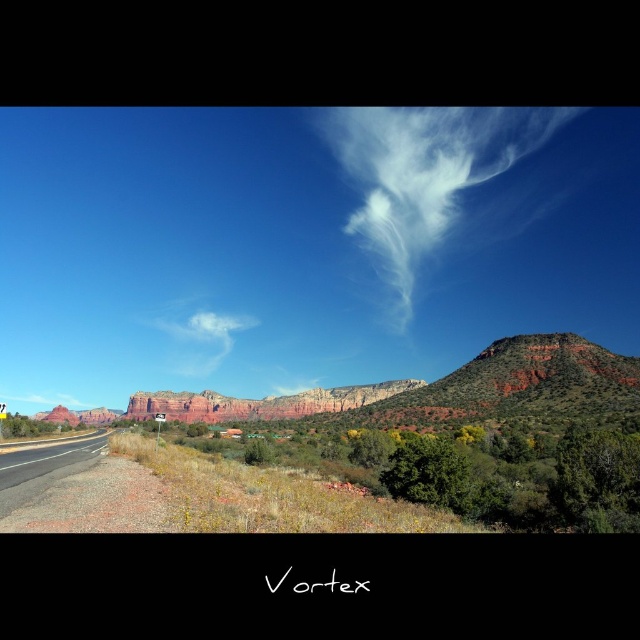
Question: Does white cotton cloud at upper center have a greater width compared to reddish-brown rocky mountain at center-right?

Choices:
 (A) yes
 (B) no

Answer: (A)

Question: Observing the image, what is the correct spatial positioning of reddish-brown rocky mountain at center-right in reference to black asphalt highway at lower left?

Choices:
 (A) below
 (B) above

Answer: (B)

Question: Among these objects, which one is nearest to the camera?

Choices:
 (A) white cotton cloud at upper center
 (B) white cotton cloud at center
 (C) black asphalt highway at lower left

Answer: (C)

Question: Which of the following is the farthest from the observer?

Choices:
 (A) white cotton cloud at upper center
 (B) white cotton cloud at center
 (C) reddish-brown rocky mountain at center-right
 (D) black asphalt highway at lower left

Answer: (B)

Question: Among these objects, which one is nearest to the camera?

Choices:
 (A) black asphalt highway at lower left
 (B) white cotton cloud at upper center
 (C) reddish-brown rocky mountain at center-right

Answer: (A)

Question: Is reddish-brown rocky mountain at center-right closer to camera compared to white cotton cloud at center?

Choices:
 (A) no
 (B) yes

Answer: (B)